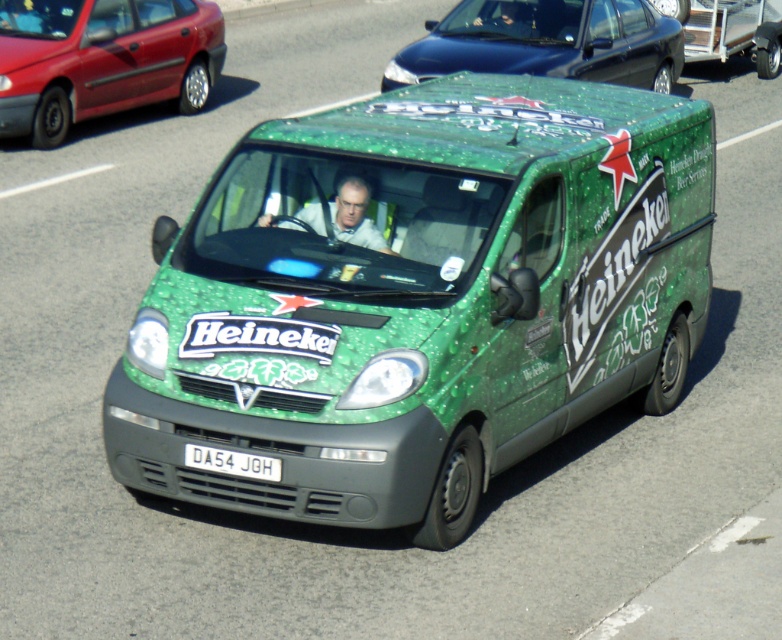
Who is positioned more to the left, shiny black sedan at upper center or white matte shirt at center?

white matte shirt at center

Is point (397, 83) less distant than point (350, 176)?

That is False.

I want to click on shiny black sedan at upper center, so click(547, 42).

Find the location of a particular element. shiny black sedan at upper center is located at coordinates (547, 42).

Between metallic red sedan at upper left and white plastic license plate at center, which one appears on the right side from the viewer's perspective?

white plastic license plate at center is more to the right.

Which of these two, metallic red sedan at upper left or white plastic license plate at center, stands taller?

metallic red sedan at upper left is taller.

Who is more forward, (24, 67) or (244, 461)?

Point (244, 461) is in front.

Locate an element on the screen. This screenshot has height=640, width=782. metallic red sedan at upper left is located at coordinates (101, 60).

Based on the photo, who is taller, white matte shirt at center or white plastic license plate at center?

With more height is white matte shirt at center.

Does white matte shirt at center appear over white plastic license plate at center?

Yes, white matte shirt at center is above white plastic license plate at center.

Between point (350, 216) and point (232, 465), which one is positioned in front?

Point (232, 465) is in front.

Locate an element on the screen. white matte shirt at center is located at coordinates (346, 216).